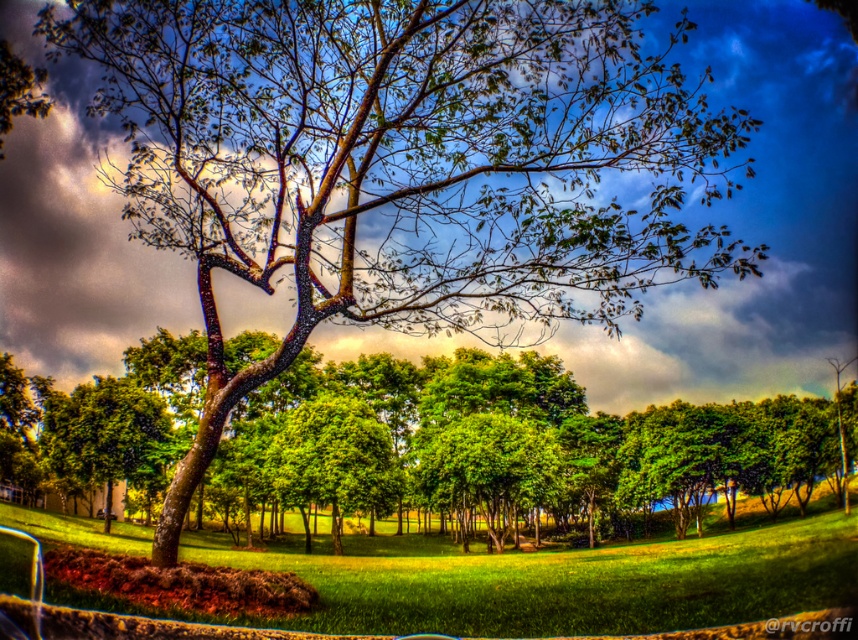
Question: Which point appears farthest from the camera in this image?

Choices:
 (A) (631, 488)
 (B) (27, 579)

Answer: (A)

Question: Is green leafy tree at center below green grassy field at center?

Choices:
 (A) no
 (B) yes

Answer: (B)

Question: Among these objects, which one is farthest from the camera?

Choices:
 (A) green leafy tree at center
 (B) green grassy field at center

Answer: (A)

Question: Is green leafy tree at center positioned behind green grassy field at center?

Choices:
 (A) no
 (B) yes

Answer: (B)

Question: Can you confirm if green leafy tree at center is thinner than green grassy field at center?

Choices:
 (A) yes
 (B) no

Answer: (B)

Question: Among these points, which one is nearest to the camera?

Choices:
 (A) (541, 529)
 (B) (497, 557)

Answer: (B)